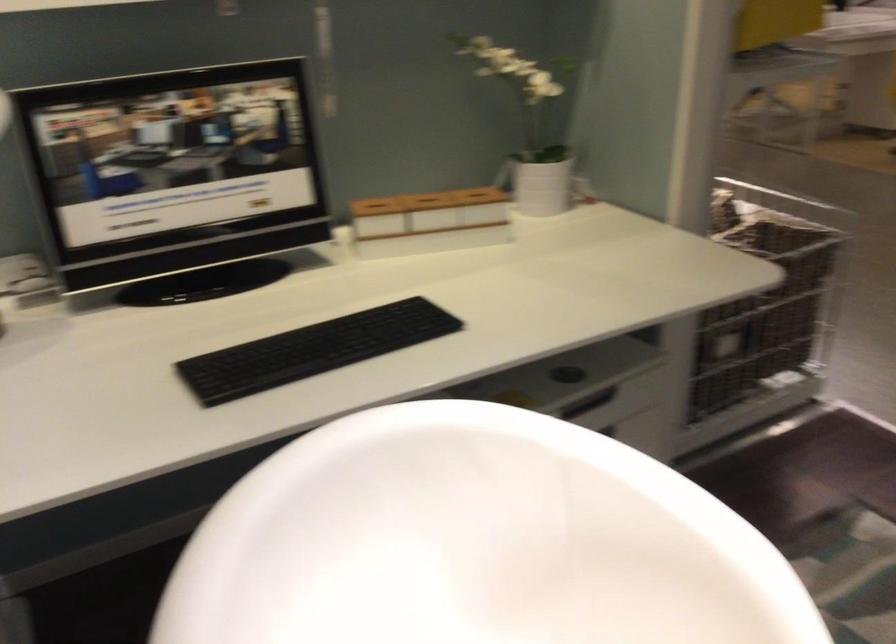
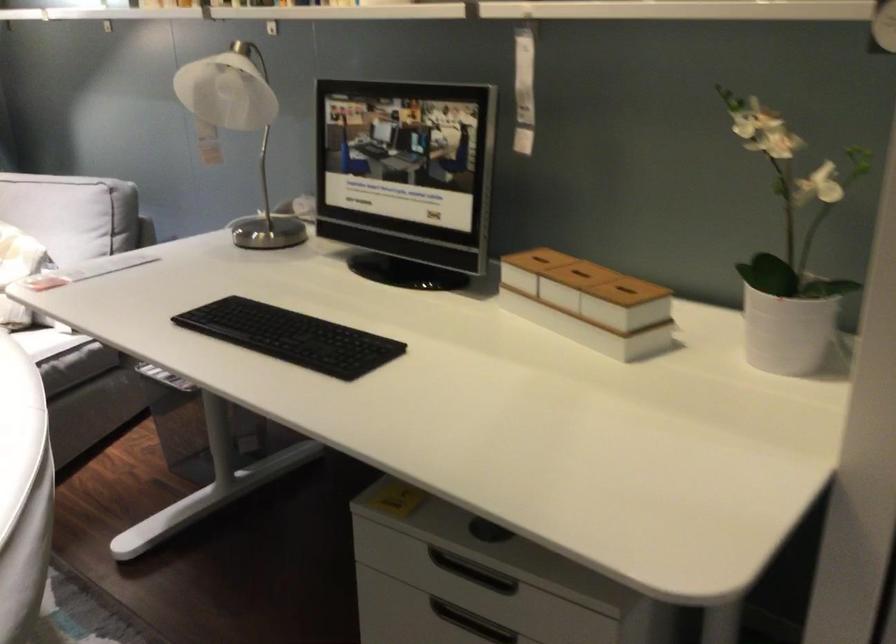
The point at (599,406) is marked in the first image. Where is the corresponding point in the second image?

(471, 571)